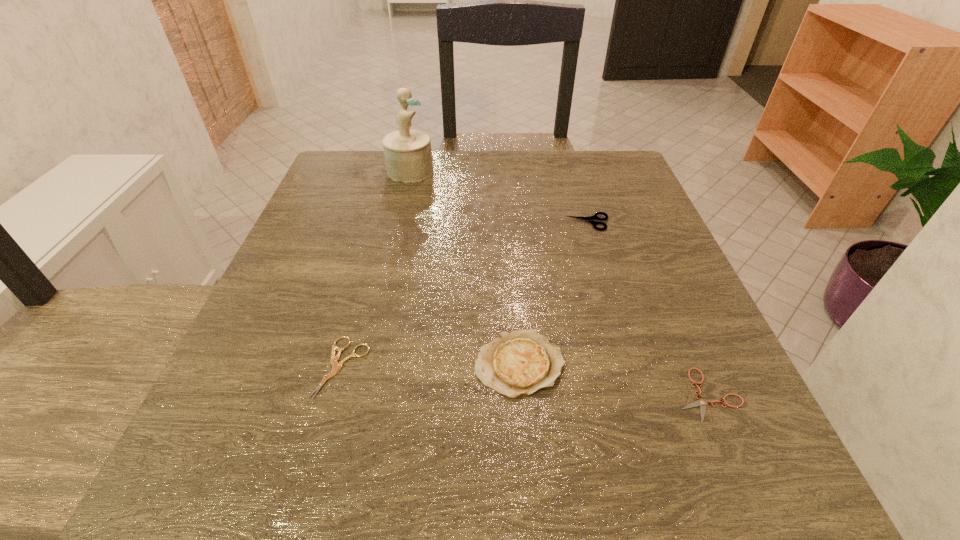
Find the location of `vacant space at the near edge`. vacant space at the near edge is located at coordinates (446, 497).

In the image, there is a desktop. Where is `free space at the left edge`? The image size is (960, 540). free space at the left edge is located at coordinates (288, 310).

Locate an element on the screen. This screenshot has width=960, height=540. free region at the right edge of the desktop is located at coordinates (609, 294).

The width and height of the screenshot is (960, 540). I want to click on free point at the far left corner, so click(x=367, y=184).

This screenshot has width=960, height=540. What are the coordinates of `blank space at the near right corner` in the screenshot? It's located at (662, 480).

Where is `vacant space in between the tallest shears and the quiche`? This screenshot has width=960, height=540. vacant space in between the tallest shears and the quiche is located at coordinates (554, 293).

Find the location of `vacant space that is in between the second tallest object and the farthest shears`. vacant space that is in between the second tallest object and the farthest shears is located at coordinates (x=554, y=293).

Find the location of a particular element. free space that is in between the leftmost shears and the tallest object is located at coordinates (376, 269).

Where is `vacant area between the second shortest object and the farthest object`? vacant area between the second shortest object and the farthest object is located at coordinates (376, 269).

I want to click on free space between the farthest object and the rightmost shears, so click(559, 283).